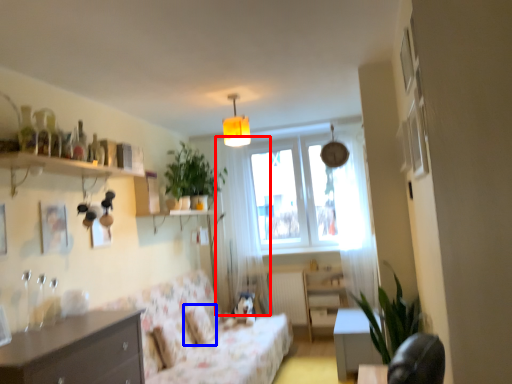
Question: Among these objects, which one is nearest to the camera, curtain (highlighted by a red box) or pillow (highlighted by a blue box)?

Choices:
 (A) curtain
 (B) pillow

Answer: (B)